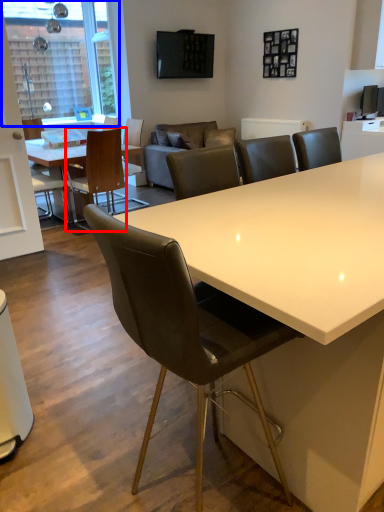
Question: Which of the following is the closest to the observer, chair (highlighted by a red box) or window screen (highlighted by a blue box)?

Choices:
 (A) chair
 (B) window screen

Answer: (A)